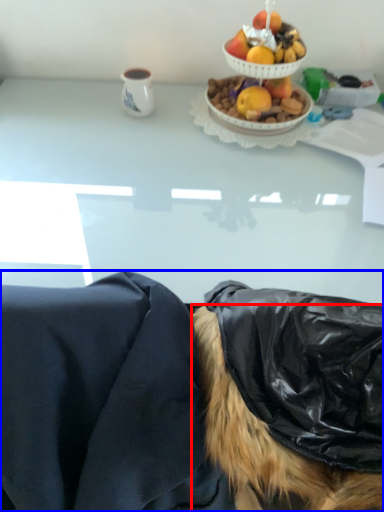
Question: Which object appears farthest to the camera in this image, wig (highlighted by a red box) or person (highlighted by a blue box)?

Choices:
 (A) wig
 (B) person

Answer: (B)